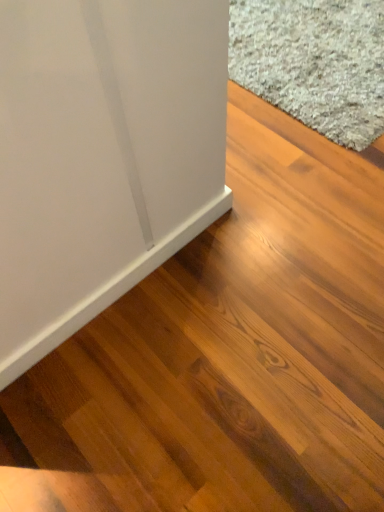
This screenshot has width=384, height=512. I want to click on vacant area that is in front of gray shaggy carpet at upper right, so click(290, 202).